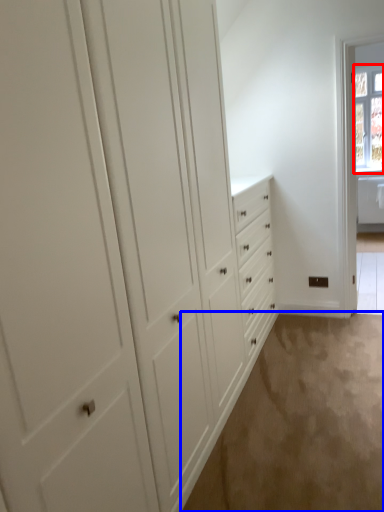
Question: Which point is further to the camera, window (highlighted by a red box) or plain (highlighted by a blue box)?

Choices:
 (A) window
 (B) plain

Answer: (A)